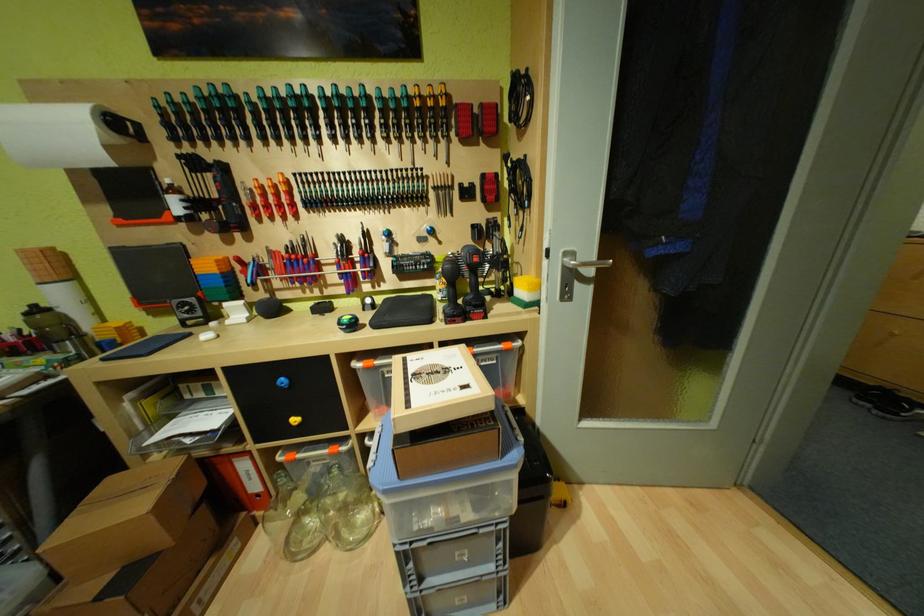
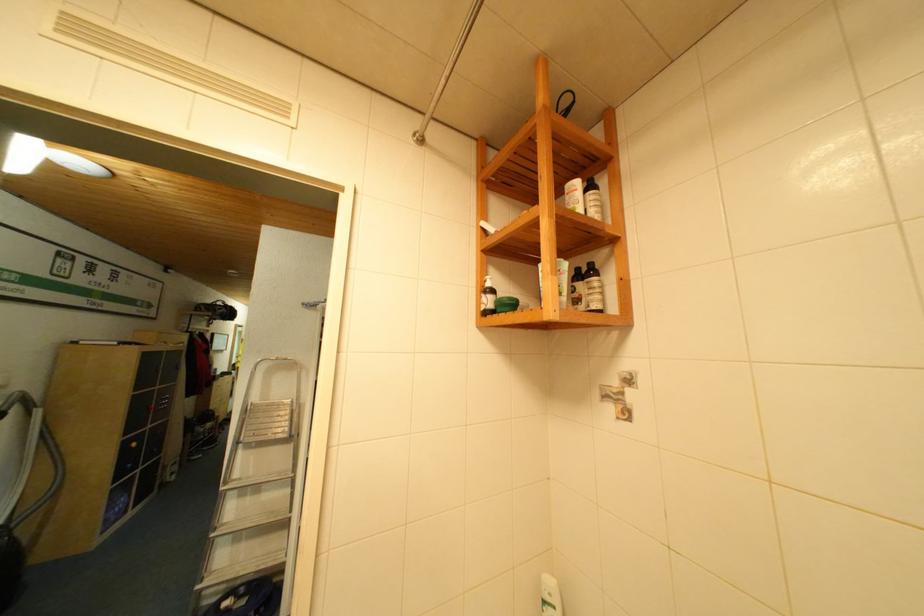
Question: I am providing you with two images of the same scene from different viewpoints. Please identify which objects are invisible in image2.

Choices:
 (A) yellow sponge
 (B) red paper cup
 (C) small cabinet knob
 (D) dark brown bottle

Answer: (A)